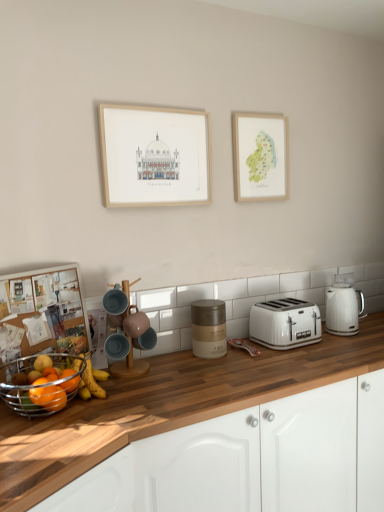
At what (x,y) coordinates should I click in order to perform the action: click on vacant region to the left of matte gold canister at center, positioned as the third appliance in left-to-right order. Please return your answer as a coordinate pair (x, y). Image resolution: width=384 pixels, height=512 pixels. Looking at the image, I should click on (172, 359).